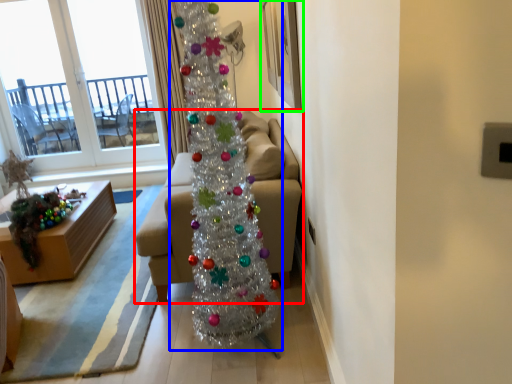
Question: Which object is positioned farthest from studio couch (highlighted by a red box)? Select from christmas tree (highlighted by a blue box) and picture frame (highlighted by a green box).

Choices:
 (A) christmas tree
 (B) picture frame

Answer: (B)